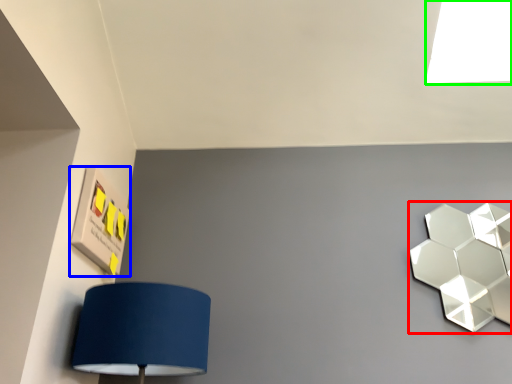
Question: Which object is positioned farthest from lamp (highlighted by a red box)? Select from square (highlighted by a blue box) and light (highlighted by a green box).

Choices:
 (A) square
 (B) light

Answer: (A)